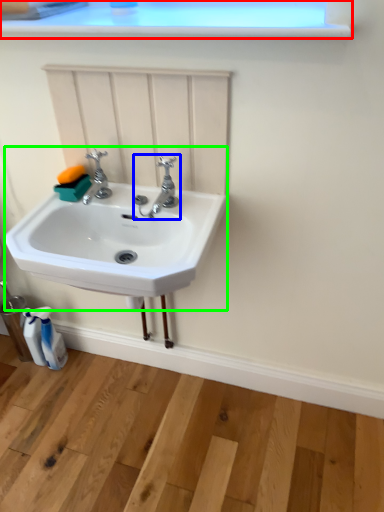
Question: Based on their relative distances, which object is nearer to window frame (highlighted by a red box)? Choose from tap (highlighted by a blue box) and sink (highlighted by a green box).

Choices:
 (A) tap
 (B) sink

Answer: (A)